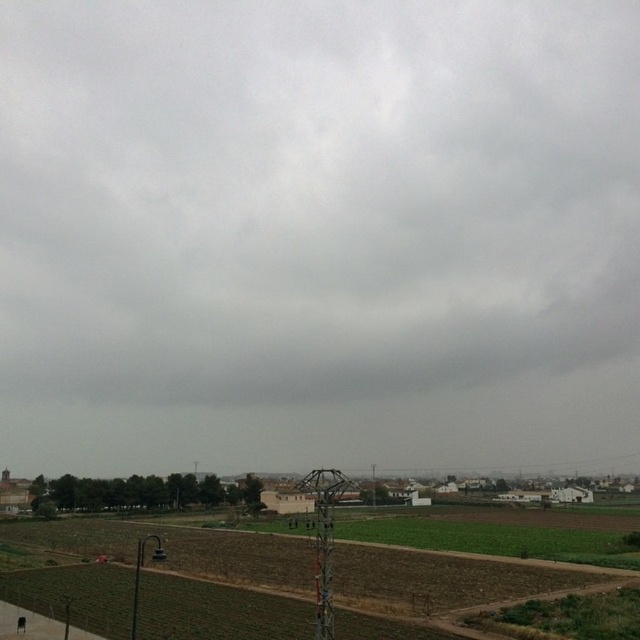
Based on the photo, between gray cloudy sky at upper center and brown soil at lower center, which one has less height?

brown soil at lower center

Does gray cloudy sky at upper center have a smaller size compared to brown soil at lower center?

Incorrect, gray cloudy sky at upper center is not smaller in size than brown soil at lower center.

Between point (394, 360) and point (120, 524), which one is positioned behind?

Positioned behind is point (394, 360).

At what (x,y) coordinates should I click in order to perform the action: click on gray cloudy sky at upper center. Please return your answer as a coordinate pair (x, y). This screenshot has height=640, width=640. Looking at the image, I should click on (314, 195).